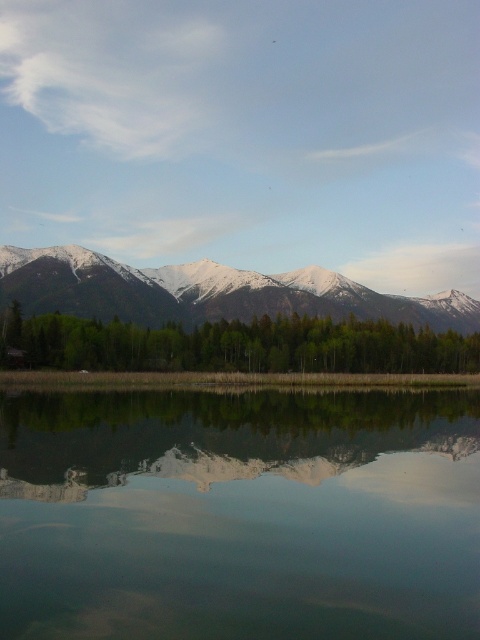
You are standing at the edge of the water and want to take a photo that includes both the green matte trees at center and the snowy white mountain range at upper center. Which object will appear larger in the photo?

The green matte trees at center will appear larger in the photo because they are closer to the viewer than the snowy white mountain range at upper center.